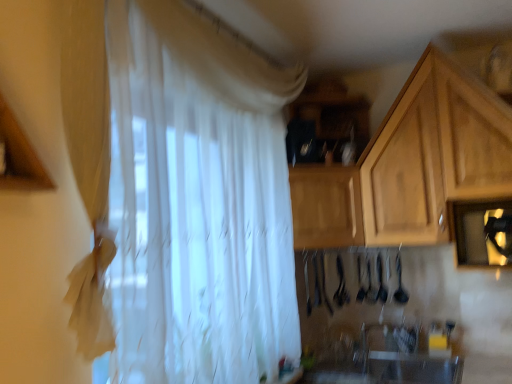
Question: From a real-world perspective, is white sheer curtain at center physically above white glossy sink at lower center?

Choices:
 (A) yes
 (B) no

Answer: (A)

Question: Is white sheer curtain at center in contact with white glossy sink at lower center?

Choices:
 (A) yes
 (B) no

Answer: (B)

Question: Does white sheer curtain at center have a smaller size compared to white glossy sink at lower center?

Choices:
 (A) yes
 (B) no

Answer: (B)

Question: Is white glossy sink at lower center inside white sheer curtain at center?

Choices:
 (A) no
 (B) yes

Answer: (A)

Question: Is white sheer curtain at center shorter than white glossy sink at lower center?

Choices:
 (A) no
 (B) yes

Answer: (A)

Question: Relative to white sheer curtain at center, is white glossy sink at lower center in front or behind?

Choices:
 (A) behind
 (B) front

Answer: (A)

Question: Is white glossy sink at lower center taller or shorter than white sheer curtain at center?

Choices:
 (A) short
 (B) tall

Answer: (A)

Question: Is point click(402, 326) positioned closer to the camera than point click(159, 301)?

Choices:
 (A) farther
 (B) closer

Answer: (A)

Question: Looking at their shapes, would you say white glossy sink at lower center is wider or thinner than white sheer curtain at center?

Choices:
 (A) wide
 (B) thin

Answer: (B)

Question: Would you say wooden cabinet at center, the first cabinetry from the left, is inside or outside white sheer curtain at center?

Choices:
 (A) outside
 (B) inside

Answer: (A)

Question: Is wooden cabinet at center, which is counted as the 2th cabinetry, starting from the right, bigger or smaller than white sheer curtain at center?

Choices:
 (A) big
 (B) small

Answer: (B)

Question: From the image's perspective, is wooden cabinet at center, which is counted as the 2th cabinetry, starting from the right, above or below white sheer curtain at center?

Choices:
 (A) below
 (B) above

Answer: (A)

Question: Considering the positions of wooden cabinet at center, which is counted as the 2th cabinetry, starting from the right, and white sheer curtain at center in the image, is wooden cabinet at center, which is counted as the 2th cabinetry, starting from the right, taller or shorter than white sheer curtain at center?

Choices:
 (A) tall
 (B) short

Answer: (B)

Question: Does point click(x=249, y=157) appear closer or farther from the camera than point click(x=369, y=339)?

Choices:
 (A) closer
 (B) farther

Answer: (A)

Question: Based on their sizes in the image, would you say white sheer curtain at center is bigger or smaller than white glossy sink at lower center?

Choices:
 (A) big
 (B) small

Answer: (A)